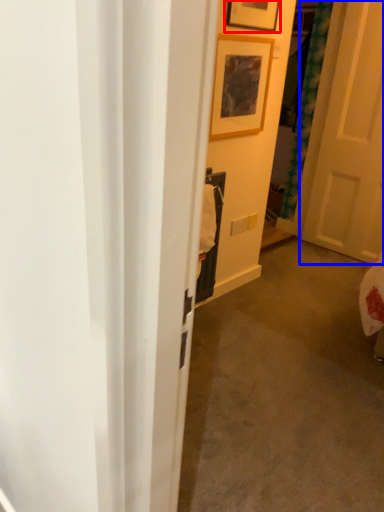
Question: Which object is closer to the camera taking this photo, picture frame (highlighted by a red box) or door (highlighted by a blue box)?

Choices:
 (A) picture frame
 (B) door

Answer: (A)